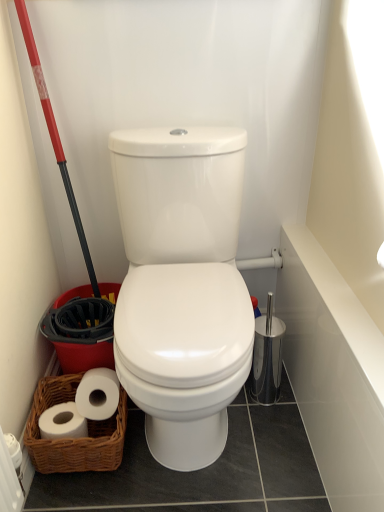
At what (x,y) coordinates should I click in order to perform the action: click on empty space that is ontop of white glossy bath at upper right (from a real-world perspective). Please return your answer as a coordinate pair (x, y). The image size is (384, 512). Looking at the image, I should click on (329, 284).